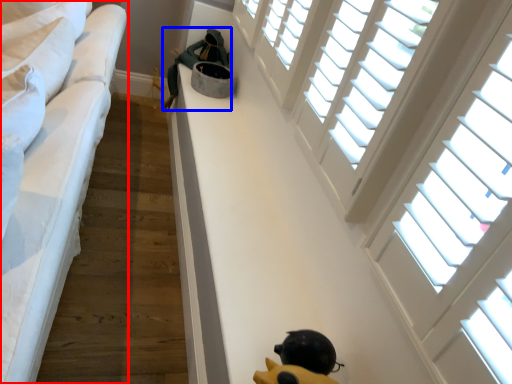
Question: Among these objects, which one is nearest to the camera, furniture (highlighted by a red box) or person (highlighted by a blue box)?

Choices:
 (A) furniture
 (B) person

Answer: (A)